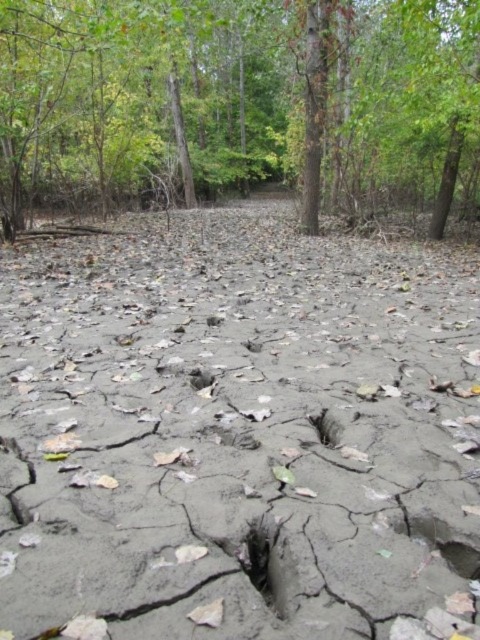
What do you see at coordinates (241, 104) in the screenshot? The image size is (480, 640). I see `brown wood tree at center` at bounding box center [241, 104].

The width and height of the screenshot is (480, 640). In order to click on brown wood tree at center in this screenshot , I will do `click(241, 104)`.

Describe the element at coordinates (241, 104) in the screenshot. I see `brown wood tree at center` at that location.

Locate an element on the screen. This screenshot has width=480, height=640. brown wood tree at center is located at coordinates (241, 104).

Does gray cracked mud at center have a greater width compared to brown wood tree at center?

Incorrect, gray cracked mud at center's width does not surpass brown wood tree at center's.

Is gray cracked mud at center positioned in front of brown wood tree at center?

Yes, it is in front of brown wood tree at center.

Which is behind, point (359, 326) or point (393, 170)?

Point (393, 170)

Identify the location of gray cracked mud at center. (236, 429).

Is point (474, 554) in front of point (311, 413)?

Yes, point (474, 554) is in front of point (311, 413).

Does dark gray mud hole at lower right have a lesser height compared to smooth gray hole at center?

Correct, dark gray mud hole at lower right is not as tall as smooth gray hole at center.

Is point (444, 544) closer to viewer compared to point (338, 422)?

Yes, point (444, 544) is in front of point (338, 422).

I want to click on dark gray mud hole at lower right, so click(460, 557).